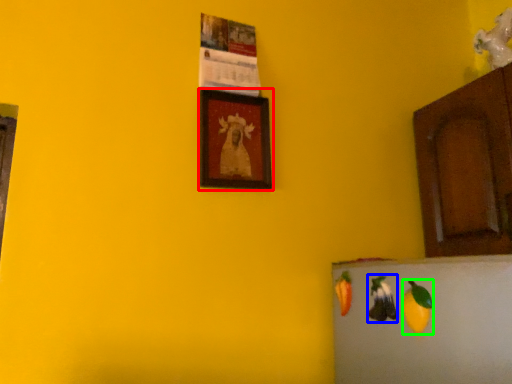
Question: Considering the real-world distances, which object is farthest from picture frame (highlighted by a red box)? fruit (highlighted by a blue box) or fruit (highlighted by a green box)?

Choices:
 (A) fruit
 (B) fruit

Answer: (B)